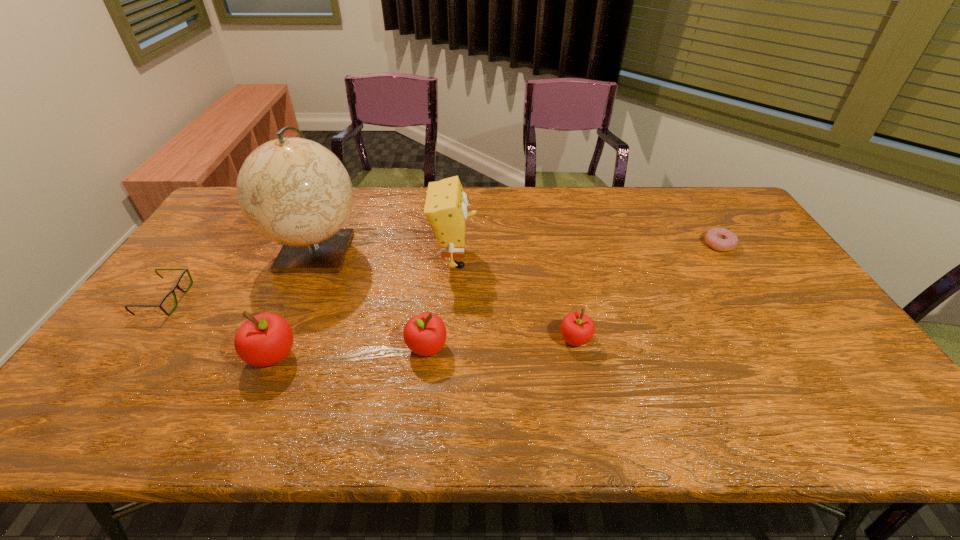
At what (x,y) coordinates should I click in order to perform the action: click on free space for a new apple on the right. Please return your answer as a coordinate pair (x, y). Looking at the image, I should click on (719, 332).